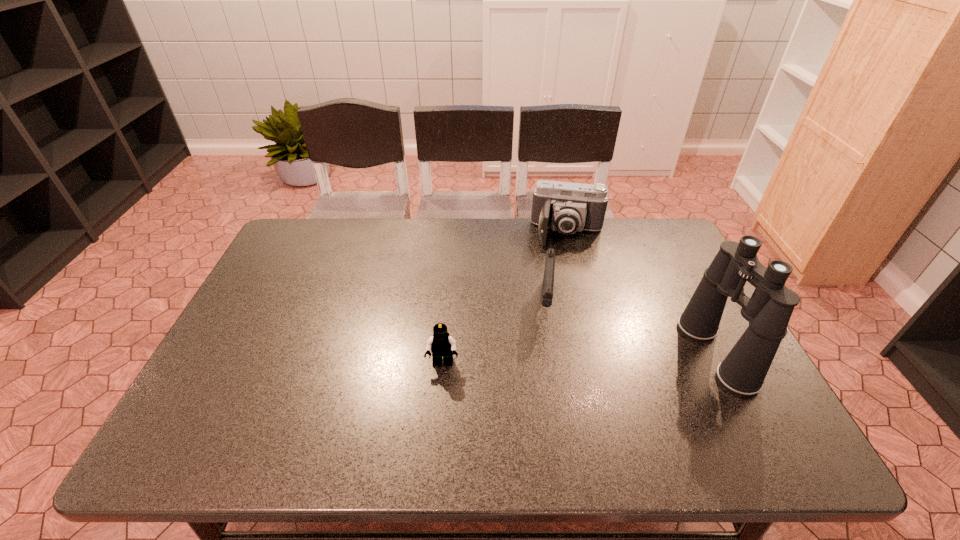
This screenshot has height=540, width=960. What are the coordinates of `vacant region at the left edge` in the screenshot? It's located at (290, 306).

Find the location of `vacant area at the far left corner of the desktop`. vacant area at the far left corner of the desktop is located at coordinates (299, 218).

Find the location of `blank space at the far right corner of the desktop`. blank space at the far right corner of the desktop is located at coordinates (629, 232).

Locate an element on the screen. The height and width of the screenshot is (540, 960). free area in between the Lego and the pistol is located at coordinates (494, 333).

This screenshot has width=960, height=540. What are the coordinates of `unoccupied area between the second tallest object and the pistol` in the screenshot? It's located at (557, 268).

Where is `free space between the leftmost object and the pistol`? This screenshot has height=540, width=960. free space between the leftmost object and the pistol is located at coordinates (494, 333).

Image resolution: width=960 pixels, height=540 pixels. I want to click on unoccupied position between the pistol and the Lego, so click(494, 333).

The height and width of the screenshot is (540, 960). Find the location of `unoccupied position between the pistol and the Lego`. unoccupied position between the pistol and the Lego is located at coordinates (494, 333).

This screenshot has width=960, height=540. Find the location of `vacant space that's between the leftmost object and the pistol`. vacant space that's between the leftmost object and the pistol is located at coordinates (494, 333).

This screenshot has width=960, height=540. I want to click on vacant region between the leftmost object and the pistol, so click(494, 333).